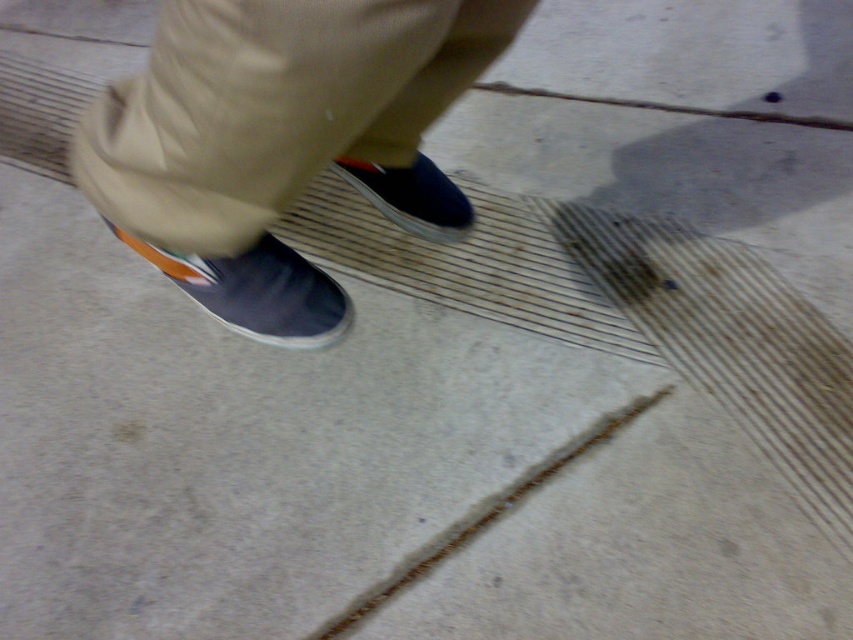
Does point (614, 426) lie in front of point (393, 193)?

Yes, point (614, 426) is in front of point (393, 193).

Is the position of brown rough concrete crack at lower center more distant than that of shiny blue slip-on shoe at center?

No, brown rough concrete crack at lower center is in front of shiny blue slip-on shoe at center.

Describe the element at coordinates (485, 516) in the screenshot. This screenshot has width=853, height=640. I see `brown rough concrete crack at lower center` at that location.

Locate an element on the screen. This screenshot has width=853, height=640. brown rough concrete crack at lower center is located at coordinates (485, 516).

Is khaki cotton pants at center positioned behind shiny blue slip-on shoe at center?

That is False.

Is point (361, 147) in front of point (363, 179)?

Yes, point (361, 147) is in front of point (363, 179).

Locate an element on the screen. The image size is (853, 640). khaki cotton pants at center is located at coordinates (258, 108).

Who is more distant from viewer, [149,209] or [354,604]?

Point [354,604]

Is point (122, 99) behind point (486, 504)?

That is False.

Image resolution: width=853 pixels, height=640 pixels. Identify the location of khaki cotton pants at center. (258, 108).

Find the location of `khaki cotton pants at center`. khaki cotton pants at center is located at coordinates (258, 108).